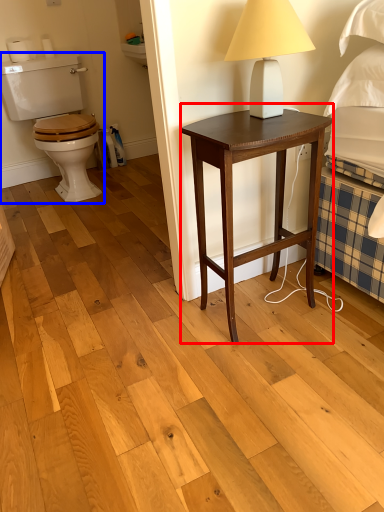
Question: Among these objects, which one is farthest to the camera, nightstand (highlighted by a red box) or sit (highlighted by a blue box)?

Choices:
 (A) nightstand
 (B) sit

Answer: (B)